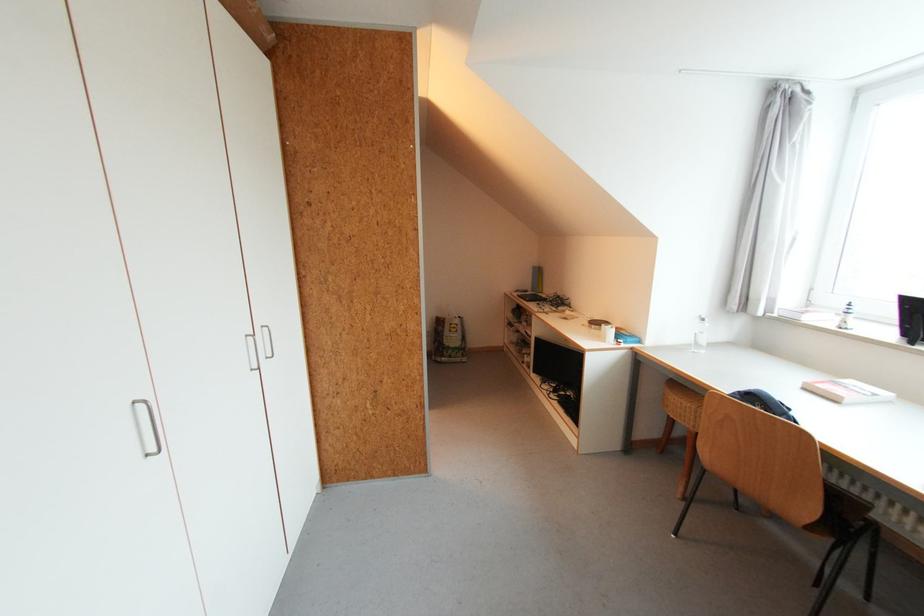
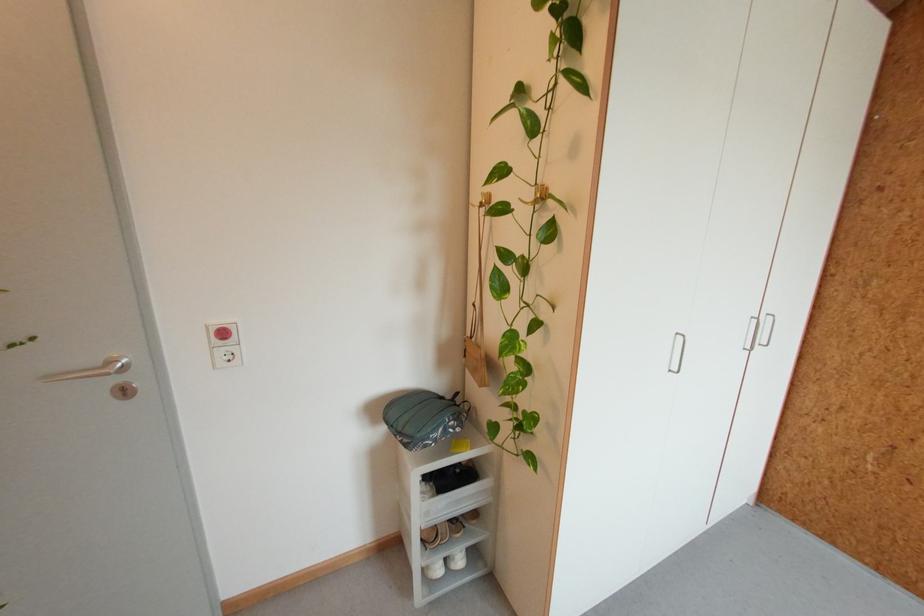
In the second image, find the point that corresponds to pixel 268 326 in the first image.

(772, 315)